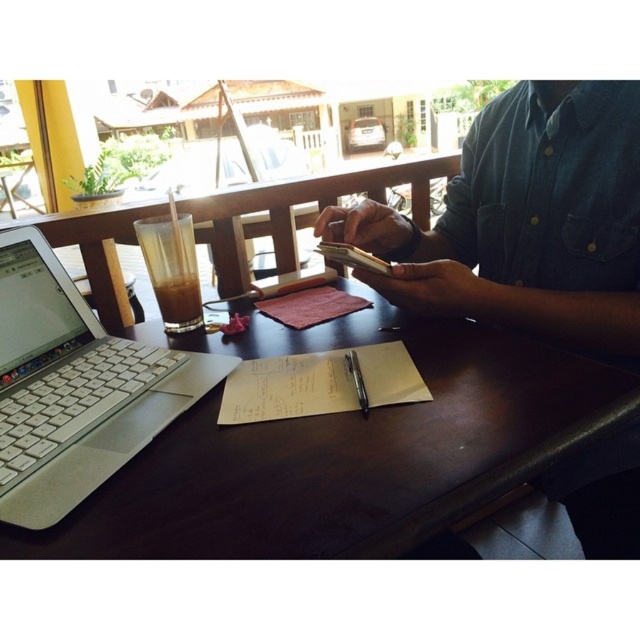
Who is higher up, brown wooden table at center or translucent glass at left?

translucent glass at left

At what (x,y) coordinates should I click in order to perform the action: click on brown wooden table at center. Please return your answer as a coordinate pair (x, y). This screenshot has width=640, height=640. Looking at the image, I should click on (346, 451).

Can you confirm if brown wooden table at center is positioned below metallic silver pen at center?

Yes.

Can you confirm if brown wooden table at center is bigger than metallic silver pen at center?

Indeed, brown wooden table at center has a larger size compared to metallic silver pen at center.

Locate an element on the screen. This screenshot has height=640, width=640. brown wooden table at center is located at coordinates (346, 451).

Does point (170, 262) come in front of point (355, 365)?

No, (170, 262) is behind (355, 365).

Which of these two, translucent glass at left or metallic silver pen at center, stands taller?

With more height is translucent glass at left.

Where is `translucent glass at left`? The image size is (640, 640). translucent glass at left is located at coordinates (172, 269).